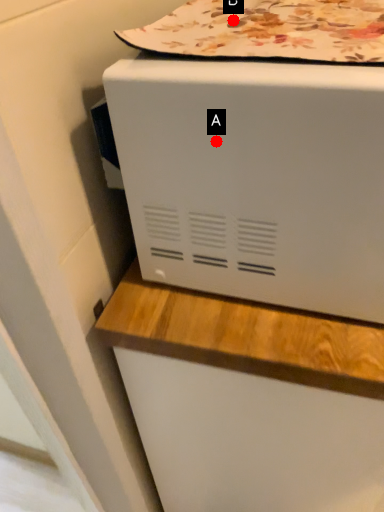
Question: Two points are circled on the image, labeled by A and B beside each circle. Which of the following is the closest to the observer?

Choices:
 (A) A is closer
 (B) B is closer

Answer: (A)